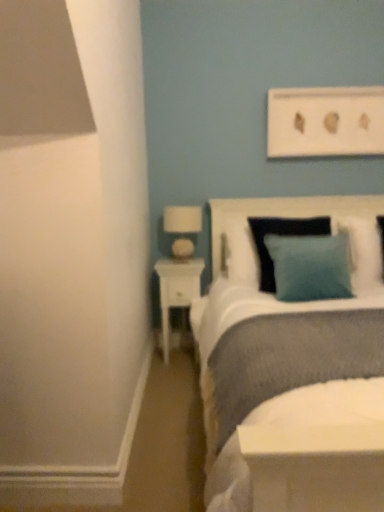
The height and width of the screenshot is (512, 384). What do you see at coordinates (310, 266) in the screenshot?
I see `teal fabric pillow at center, the 1th pillow when ordered from front to back` at bounding box center [310, 266].

Describe the element at coordinates (362, 252) in the screenshot. I see `teal fabric pillow at upper right, which ranks as the 2th pillow in front-to-back order` at that location.

Measure the distance between point (219, 253) and camera.

They are 9.25 feet apart.

In order to face white glossy nightstand at lower left, should I rotate leftwards or rightwards?

It's best to rotate left around 1.256 degrees.

Describe the element at coordinates (177, 290) in the screenshot. I see `white glossy nightstand at lower left` at that location.

The width and height of the screenshot is (384, 512). In order to click on teal fabric pillow at center, the 1th pillow when ordered from front to back in this screenshot , I will do point(310,266).

Can you tell me how much teal fabric pillow at center, positioned as the first pillow in left-to-right order, and white glossy nightstand at lower left differ in facing direction?

1.78 degrees.

From a real-world perspective, between teal fabric pillow at center, the 1th pillow when ordered from front to back, and white glossy nightstand at lower left, who is vertically higher?

In real-world perspective, teal fabric pillow at center, the 1th pillow when ordered from front to back, is above.

Could you measure the distance between teal fabric pillow at center, the 1th pillow when ordered from front to back, and white glossy nightstand at lower left?

teal fabric pillow at center, the 1th pillow when ordered from front to back, is 29.25 inches from white glossy nightstand at lower left.

At what (x,y) coordinates should I click in order to perform the action: click on pillow that is the 1st one above the white glossy nightstand at lower left (from a real-world perspective). Please return your answer as a coordinate pair (x, y). Looking at the image, I should click on (310, 266).

Is textured white headboard at upper right at the left side of teal fabric pillow at center, the second pillow positioned from the back?

Yes, textured white headboard at upper right is to the left of teal fabric pillow at center, the second pillow positioned from the back.

From a real-world perspective, does textured white headboard at upper right sit lower than teal fabric pillow at center, the second pillow positioned from the back?

No, from a real-world perspective, textured white headboard at upper right is not below teal fabric pillow at center, the second pillow positioned from the back.

Is textured white headboard at upper right oriented towards teal fabric pillow at center, which ranks as the 2th pillow in right-to-left order?

Yes, textured white headboard at upper right is oriented towards teal fabric pillow at center, which ranks as the 2th pillow in right-to-left order.

Is the position of textured white headboard at upper right more distant than that of teal fabric pillow at center, the 1th pillow when ordered from front to back?

Yes, textured white headboard at upper right is further from the viewer.

Image resolution: width=384 pixels, height=512 pixels. Find the location of `the 1st pillow above when counting from the white glossy nightstand at lower left (from the image's perspective)`. the 1st pillow above when counting from the white glossy nightstand at lower left (from the image's perspective) is located at coordinates (310, 266).

Which point is more distant from viewer, (190, 263) or (323, 272)?

The point (190, 263) is behind.

Measure the distance between white glossy nightstand at lower left and teal fabric pillow at center, the 1th pillow when ordered from front to back.

white glossy nightstand at lower left is 74.29 centimeters from teal fabric pillow at center, the 1th pillow when ordered from front to back.

Which object is further away from the camera taking this photo, white glossy nightstand at lower left or teal fabric pillow at center, positioned as the first pillow in left-to-right order?

Positioned behind is white glossy nightstand at lower left.

In order to click on pillow behind the textured white headboard at upper right in this screenshot , I will do `click(362, 252)`.

Relative to textured white headboard at upper right, is teal fabric pillow at upper right, which is the first pillow in right-to-left order, in front or behind?

In the image, teal fabric pillow at upper right, which is the first pillow in right-to-left order, appears behind textured white headboard at upper right.

What's the angular difference between teal fabric pillow at upper right, the 2th pillow viewed from the left, and textured white headboard at upper right's facing directions?

The facing directions of teal fabric pillow at upper right, the 2th pillow viewed from the left, and textured white headboard at upper right are 0.00236 degrees apart.

From a real-world perspective, is white glossy nightstand at lower left positioned under white fabric lampshade at upper left based on gravity?

Correct, in the physical world, white glossy nightstand at lower left is lower than white fabric lampshade at upper left.

Based on their positions, is white glossy nightstand at lower left located to the left or right of white fabric lampshade at upper left?

From the image, it's evident that white glossy nightstand at lower left is to the left of white fabric lampshade at upper left.

Are white glossy nightstand at lower left and white fabric lampshade at upper left making contact?

No.

Is there a large distance between white glossy nightstand at lower left and textured white headboard at upper right?

No, white glossy nightstand at lower left is not far from textured white headboard at upper right.

Is textured white headboard at upper right inside white glossy nightstand at lower left?

No, textured white headboard at upper right is located outside of white glossy nightstand at lower left.

Can you tell me how much white glossy nightstand at lower left and textured white headboard at upper right differ in facing direction?

They differ by 1.78 degrees in their facing directions.

Consider the image. From a real-world perspective, is teal fabric pillow at center, the 1th pillow when ordered from front to back, positioned above or below teal fabric pillow at upper right, which ranks as the 2th pillow in front-to-back order?

Clearly, from a real-world perspective, teal fabric pillow at center, the 1th pillow when ordered from front to back, is below teal fabric pillow at upper right, which ranks as the 2th pillow in front-to-back order.

Is teal fabric pillow at center, which ranks as the 2th pillow in right-to-left order, positioned with its back to teal fabric pillow at upper right, which ranks as the 2th pillow in front-to-back order?

That's not correct — teal fabric pillow at center, which ranks as the 2th pillow in right-to-left order, is not looking away from teal fabric pillow at upper right, which ranks as the 2th pillow in front-to-back order.

What are the coordinates of `nightstand below the teal fabric pillow at center, the 1th pillow when ordered from front to back (from a real-world perspective)` in the screenshot? It's located at (177, 290).

Identify the location of headboard that appears above the teal fabric pillow at center, which ranks as the 2th pillow in right-to-left order (from a real-world perspective). (284, 213).

Looking at the image, which one is located further to teal fabric pillow at center, the 1th pillow when ordered from front to back, white fabric lampshade at upper left or white glossy nightstand at lower left?

white fabric lampshade at upper left lies further to teal fabric pillow at center, the 1th pillow when ordered from front to back, than the other object.

From the image, which object appears to be nearer to teal fabric pillow at upper right, which is the first pillow in right-to-left order, white fabric lampshade at upper left or textured white headboard at upper right?

Based on the image, textured white headboard at upper right appears to be nearer to teal fabric pillow at upper right, which is the first pillow in right-to-left order.

Estimate the real-world distances between objects in this image. Which object is further from teal fabric pillow at upper right, which is the first pillow in right-to-left order, white glossy nightstand at lower left or teal fabric pillow at center, the 1th pillow when ordered from front to back?

white glossy nightstand at lower left lies further to teal fabric pillow at upper right, which is the first pillow in right-to-left order, than the other object.

When comparing their distances from teal fabric pillow at center, the 1th pillow when ordered from front to back, does textured white headboard at upper right or white glossy nightstand at lower left seem further?

Among the two, white glossy nightstand at lower left is located further to teal fabric pillow at center, the 1th pillow when ordered from front to back.

Based on their spatial positions, is teal fabric pillow at upper right, the 2th pillow viewed from the left, or textured white headboard at upper right further from white fabric lampshade at upper left?

teal fabric pillow at upper right, the 2th pillow viewed from the left.

Which object lies further to the anchor point teal fabric pillow at upper right, positioned as the 1th pillow in back-to-front order, textured white headboard at upper right or teal fabric pillow at center, the 1th pillow when ordered from front to back?

Based on the image, teal fabric pillow at center, the 1th pillow when ordered from front to back, appears to be further to teal fabric pillow at upper right, positioned as the 1th pillow in back-to-front order.

Estimate the real-world distances between objects in this image. Which object is closer to teal fabric pillow at center, the 1th pillow when ordered from front to back, white glossy nightstand at lower left or teal fabric pillow at upper right, which ranks as the 2th pillow in front-to-back order?

teal fabric pillow at upper right, which ranks as the 2th pillow in front-to-back order.

When comparing their distances from white glossy nightstand at lower left, does teal fabric pillow at center, the second pillow positioned from the back, or white fabric lampshade at upper left seem further?

teal fabric pillow at center, the second pillow positioned from the back.

Where is `headboard between white glossy nightstand at lower left and teal fabric pillow at upper right, which is the first pillow in right-to-left order, from left to right`? headboard between white glossy nightstand at lower left and teal fabric pillow at upper right, which is the first pillow in right-to-left order, from left to right is located at coordinates (284, 213).

The height and width of the screenshot is (512, 384). What are the coordinates of `headboard between white glossy nightstand at lower left and teal fabric pillow at center, the second pillow positioned from the back, in the horizontal direction` in the screenshot? It's located at point(284,213).

At what (x,y) coordinates should I click in order to perform the action: click on headboard situated between white fabric lampshade at upper left and teal fabric pillow at center, positioned as the first pillow in left-to-right order, from left to right. Please return your answer as a coordinate pair (x, y). This screenshot has width=384, height=512. Looking at the image, I should click on (284, 213).

Locate an element on the screen. pillow between white glossy nightstand at lower left and teal fabric pillow at upper right, positioned as the 1th pillow in back-to-front order is located at coordinates (310, 266).